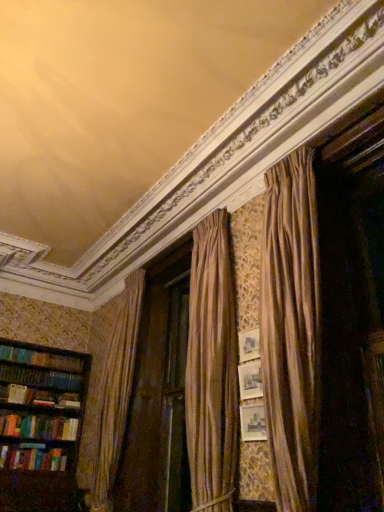
Question: Is multicolored hardcover books at left to the left or to the right of wooden bookshelf at left in the image?

Choices:
 (A) right
 (B) left

Answer: (B)

Question: Is multicolored hardcover books at left bigger or smaller than wooden bookshelf at left?

Choices:
 (A) big
 (B) small

Answer: (B)

Question: In terms of width, does multicolored hardcover books at left look wider or thinner when compared to wooden bookshelf at left?

Choices:
 (A) wide
 (B) thin

Answer: (B)

Question: Is wooden bookshelf at left bigger or smaller than multicolored hardcover books at left?

Choices:
 (A) small
 (B) big

Answer: (B)

Question: From the image's perspective, is wooden bookshelf at left located above or below multicolored hardcover books at left?

Choices:
 (A) above
 (B) below

Answer: (A)

Question: Is wooden bookshelf at left taller or shorter than multicolored hardcover books at left?

Choices:
 (A) tall
 (B) short

Answer: (A)

Question: Choose the correct answer: Is wooden bookshelf at left inside multicolored hardcover books at left or outside it?

Choices:
 (A) outside
 (B) inside

Answer: (A)